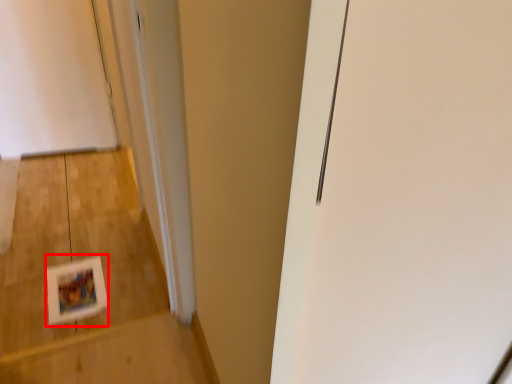
Question: From the image's perspective, where is postcard (annotated by the red box) located in relation to stairwell in the image?

Choices:
 (A) above
 (B) below

Answer: (B)